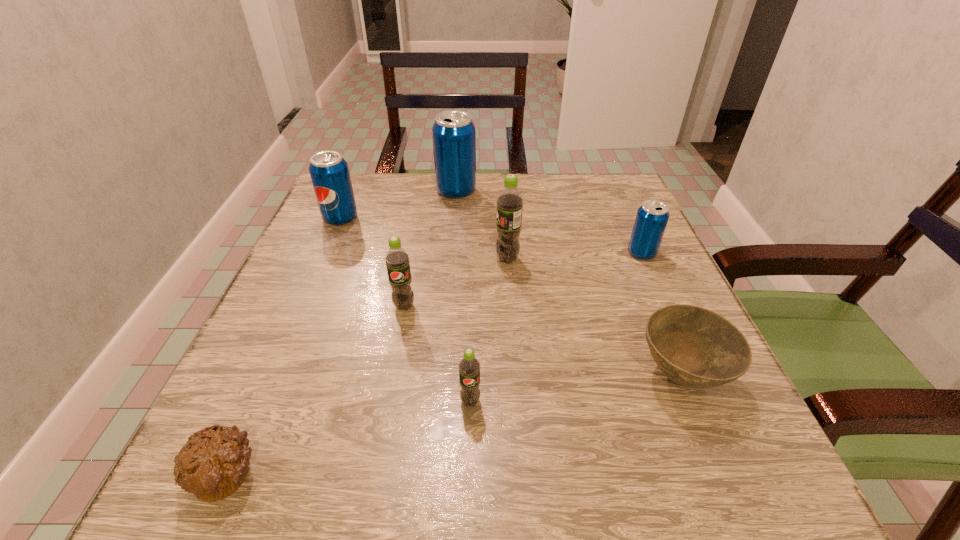
Where is `free space located 0.230m on the front label of the fourth nearest object`? The width and height of the screenshot is (960, 540). free space located 0.230m on the front label of the fourth nearest object is located at coordinates (382, 428).

What are the coordinates of `vacant point located on the left of the nearest blue pop soda` in the screenshot? It's located at (484, 253).

Where is `free space located on the front label of the smallest green soda`? free space located on the front label of the smallest green soda is located at coordinates (468, 500).

Image resolution: width=960 pixels, height=540 pixels. Find the location of `vacant point located on the left of the seventh tallest object`. vacant point located on the left of the seventh tallest object is located at coordinates (598, 375).

Locate an element on the screen. The width and height of the screenshot is (960, 540). free space located on the right of the nearest object is located at coordinates (305, 471).

This screenshot has width=960, height=540. I want to click on object at the near edge, so click(213, 463).

I want to click on pop soda that is at the left edge, so click(329, 172).

Find the location of a particular element. The height and width of the screenshot is (540, 960). muffin that is at the left edge is located at coordinates 213,463.

Locate an element on the screen. This screenshot has width=960, height=540. pop soda positioned at the right edge is located at coordinates (652, 216).

Identify the location of bowl that is at the right edge. (694, 347).